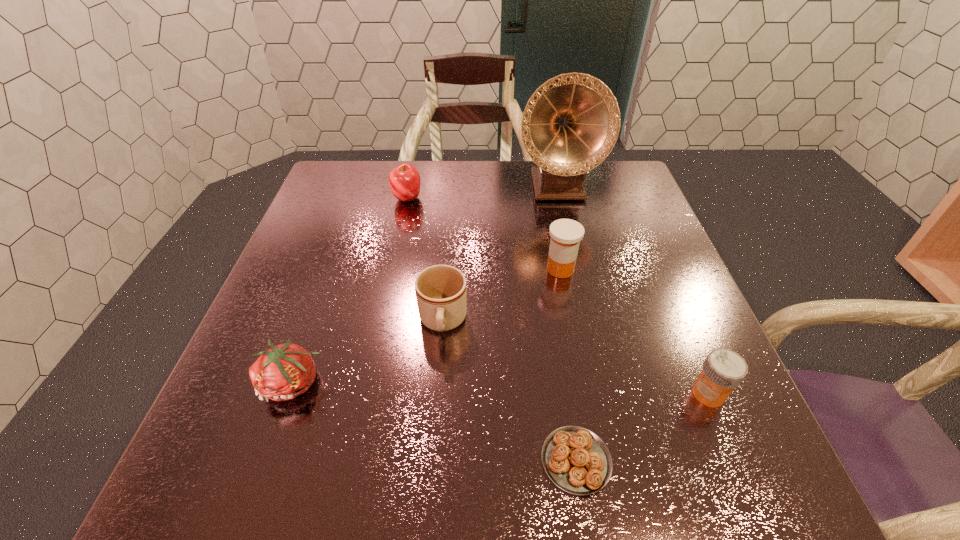
At what (x,y) coordinates should I click in order to perform the action: click on the tallest object. Please return your answer as a coordinate pair (x, y). Looking at the image, I should click on (571, 123).

Where is `the left medicine`? The width and height of the screenshot is (960, 540). the left medicine is located at coordinates (566, 234).

In order to click on the taller medicine in this screenshot , I will do `click(566, 234)`.

Where is `apple`? The image size is (960, 540). apple is located at coordinates (404, 180).

Find the location of a particular element. This screenshot has width=960, height=540. the third object from left to right is located at coordinates (440, 290).

At what (x,y) coordinates should I click in order to perform the action: click on mug. Please return your answer as a coordinate pair (x, y). The height and width of the screenshot is (540, 960). Looking at the image, I should click on (440, 290).

You are a GUI agent. You are given a task and a screenshot of the screen. Output one action in this format:
    pyautogui.click(x=<x>, y=<y>)
    Task: Click on the shorter medicine
    
    Given the screenshot: What is the action you would take?
    pyautogui.click(x=723, y=370)

Where is `the rightmost object`? the rightmost object is located at coordinates pyautogui.click(x=723, y=370).

Locate an element on the screen. The image size is (960, 540). tomato is located at coordinates click(x=285, y=371).

Image resolution: width=960 pixels, height=540 pixels. I want to click on pastry, so click(575, 459).